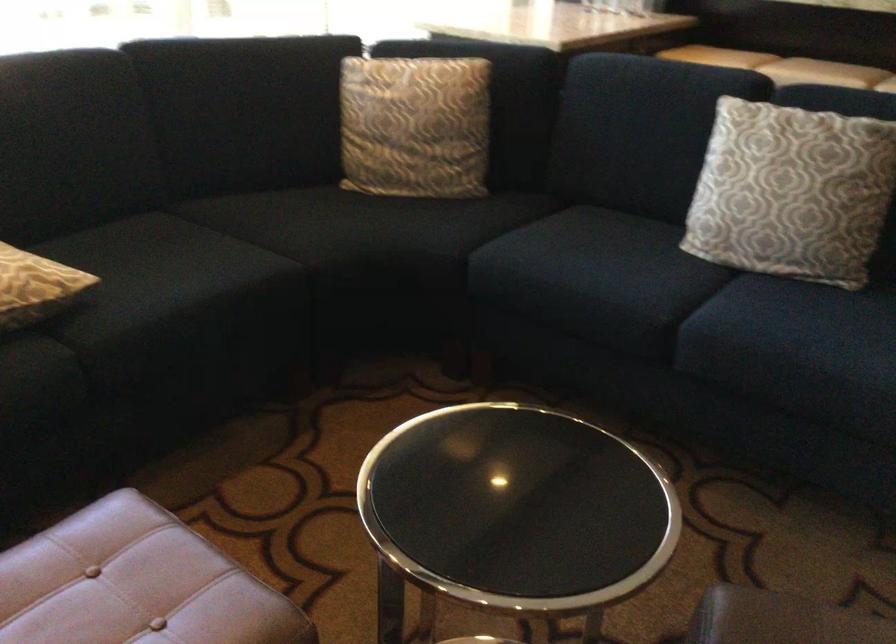
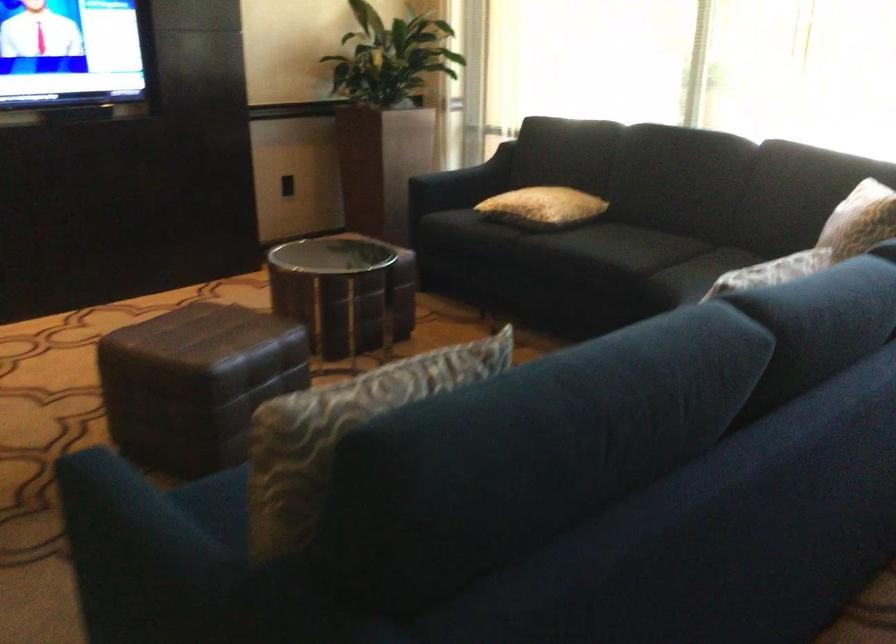
In the second image, find the point that corresponds to the point at 479,96 in the first image.

(859, 220)